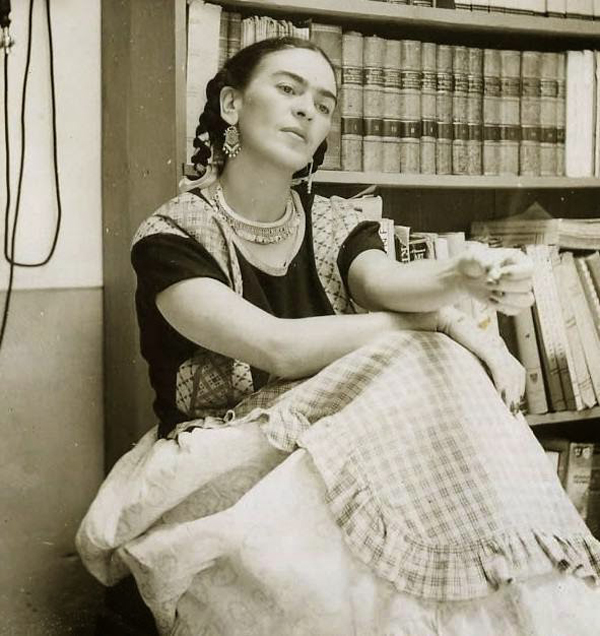
Locate an element on the screen. The height and width of the screenshot is (636, 600). cord is located at coordinates (40, 265).